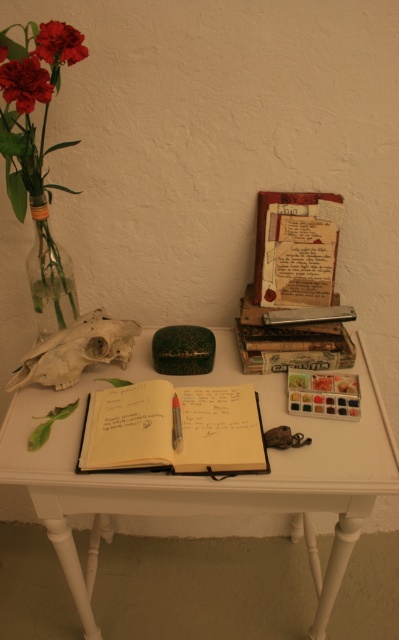
Question: Is white paper notebook at center to the right of metallic silver notebook at center from the viewer's perspective?

Choices:
 (A) no
 (B) yes

Answer: (A)

Question: Which point is closer to the camera?

Choices:
 (A) (112, 408)
 (B) (63, 321)

Answer: (A)

Question: Which of these objects is positioned closest to the metallic silver notebook at center?

Choices:
 (A) black plastic pen at center
 (B) matte red flower at upper left
 (C) matte red carnation at upper left

Answer: (A)

Question: Which point is farther to the camera?

Choices:
 (A) (312, 316)
 (B) (9, 67)
 (C) (79, 492)

Answer: (A)

Question: Can you confirm if matte red flower at upper left is positioned to the right of matte red carnation at upper left?

Choices:
 (A) yes
 (B) no

Answer: (B)

Question: Considering the relative positions of matte red flower at upper left and matte red carnation at upper left in the image provided, where is matte red flower at upper left located with respect to matte red carnation at upper left?

Choices:
 (A) right
 (B) left

Answer: (B)